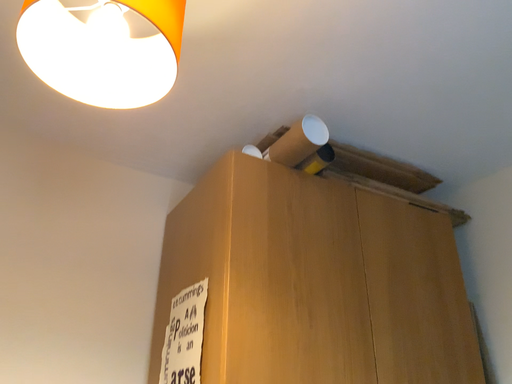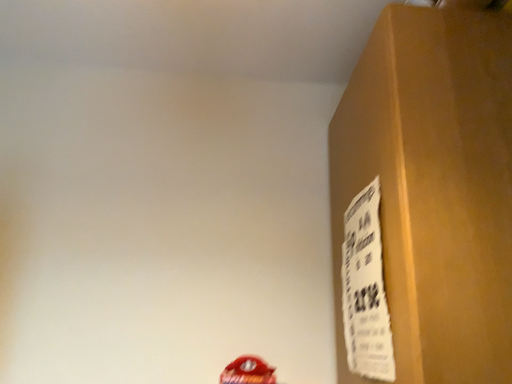
Question: How did the camera likely rotate when shooting the video?

Choices:
 (A) rotated upward
 (B) rotated downward

Answer: (B)